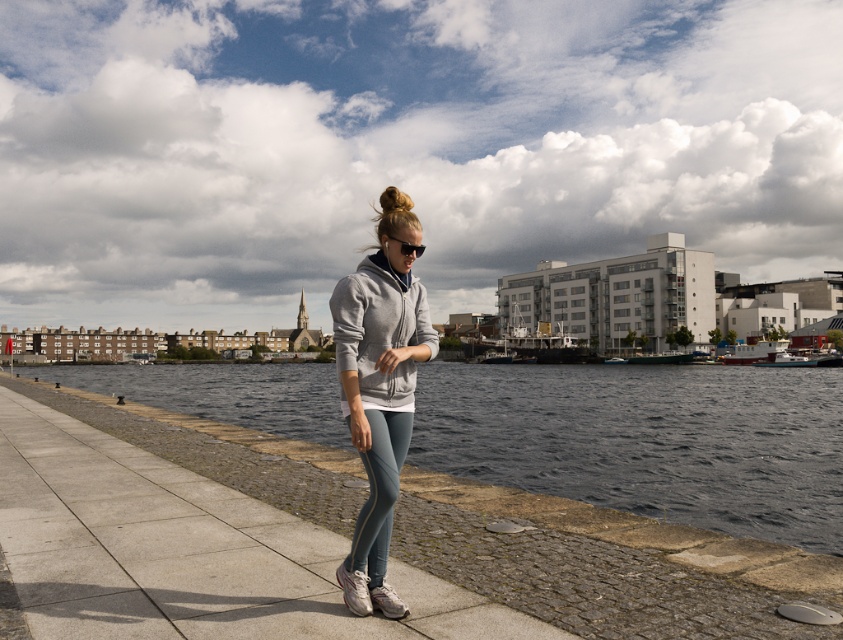
Question: Which of the following is the closest to the observer?

Choices:
 (A) blonde hair at center
 (B) gray fleece sweatshirt at center

Answer: (B)

Question: Which point is closer to the camera?

Choices:
 (A) (353, 346)
 (B) (390, 193)

Answer: (A)

Question: Does dark blue water at center have a greater width compared to matte gray hoodie at center?

Choices:
 (A) no
 (B) yes

Answer: (B)

Question: Which is nearer to the gray fleece sweatshirt at center?

Choices:
 (A) blonde hair at center
 (B) matte gray hoodie at center
 (C) dark blue water at center

Answer: (B)

Question: Is dark blue water at center to the right of blonde hair at center from the viewer's perspective?

Choices:
 (A) no
 (B) yes

Answer: (B)

Question: Can you confirm if dark blue water at center is smaller than matte gray hoodie at center?

Choices:
 (A) yes
 (B) no

Answer: (B)